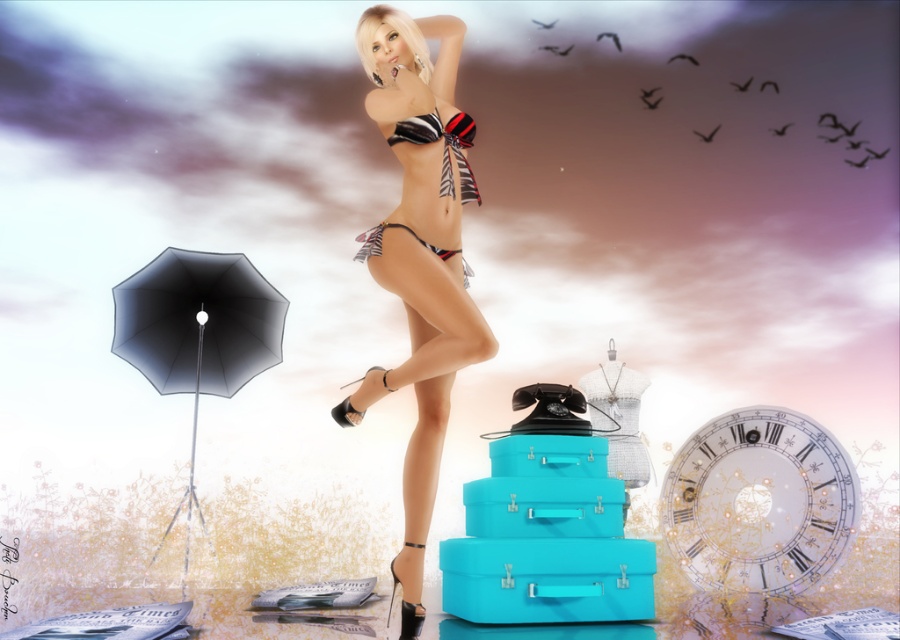
Question: Which object is closer to the camera taking this photo?

Choices:
 (A) white glossy clock at center right
 (B) zebra print bikini at center
 (C) zebra print fabric bikini top at center
 (D) black matte umbrella at left

Answer: (B)

Question: Which point is farther to the camera?

Choices:
 (A) (423, 212)
 (B) (776, 580)
 (C) (466, 164)
 (D) (273, 291)

Answer: (D)

Question: Which of the following is the farthest from the observer?

Choices:
 (A) (432, 122)
 (B) (453, 332)
 (C) (725, 544)
 (D) (452, 189)

Answer: (C)

Question: Is black matte umbrella at left to the left of zebra print fabric bikini top at center from the viewer's perspective?

Choices:
 (A) yes
 (B) no

Answer: (A)

Question: Does white glossy clock at center right appear on the left side of zebra print fabric bikini at center?

Choices:
 (A) no
 (B) yes

Answer: (A)

Question: Does black matte umbrella at left have a greater width compared to zebra print fabric bikini top at center?

Choices:
 (A) no
 (B) yes

Answer: (B)